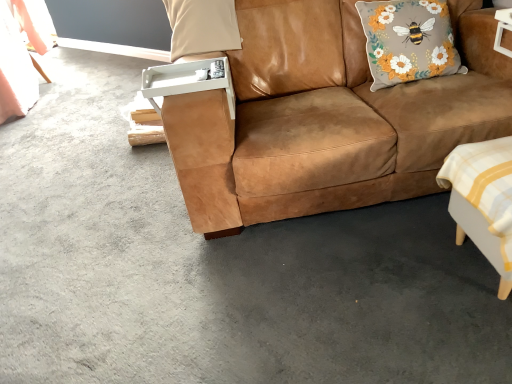
Question: In terms of height, does floral fabric cushion with bee design at upper right, the 2th pillow positioned from the left, look taller or shorter compared to white checkered fabric swivel chair at lower right?

Choices:
 (A) short
 (B) tall

Answer: (B)

Question: Is point (449, 43) closer or farther from the camera than point (501, 223)?

Choices:
 (A) farther
 (B) closer

Answer: (A)

Question: Which of these objects is positioned closest to the beige fabric pillow at upper center, the 1th pillow positioned from the left?

Choices:
 (A) floral fabric cushion with bee design at upper right, which ranks as the first pillow in right-to-left order
 (B) white checkered fabric swivel chair at lower right
 (C) suede brown couch at center

Answer: (C)

Question: Estimate the real-world distances between objects in this image. Which object is closer to the beige fabric pillow at upper center, which ranks as the second pillow in right-to-left order?

Choices:
 (A) suede brown couch at center
 (B) floral fabric cushion with bee design at upper right, which ranks as the first pillow in right-to-left order
 (C) white checkered fabric swivel chair at lower right

Answer: (A)